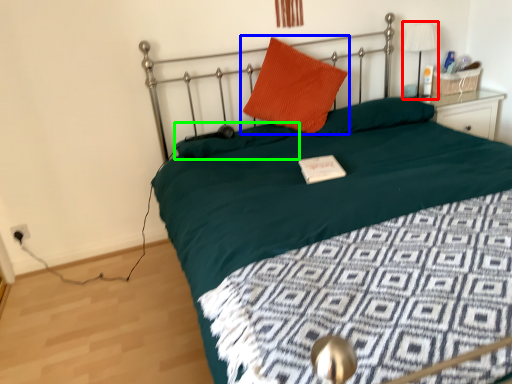
Question: Estimate the real-world distances between objects in this image. Which object is closer to table lamp (highlighted by a red box), pillow (highlighted by a blue box) or pillow (highlighted by a green box)?

Choices:
 (A) pillow
 (B) pillow

Answer: (A)